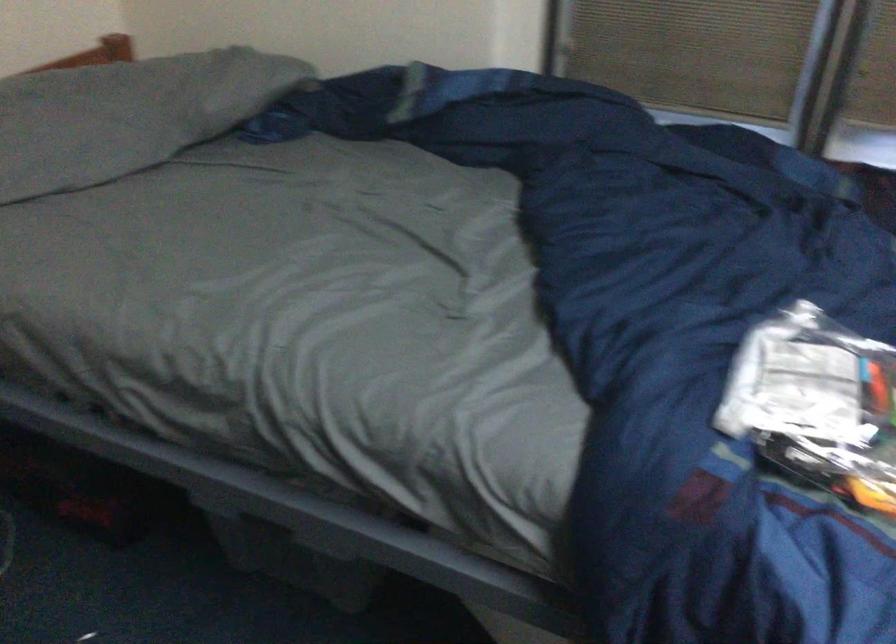
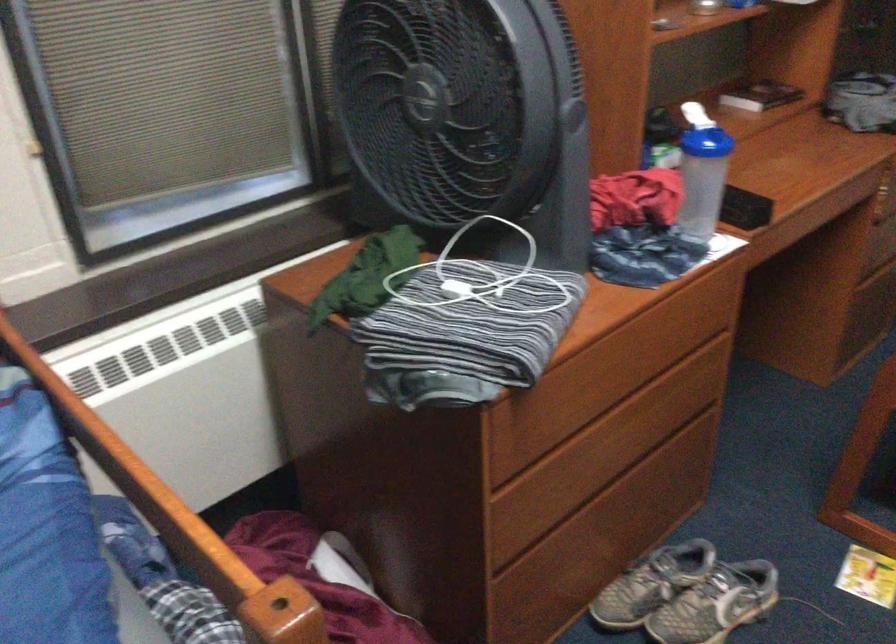
Question: The camera is either moving clockwise (left) or counter-clockwise (right) around the object. The first image is from the beginning of the video and the second image is from the end. Is the camera moving left or right when shooting the video?

Choices:
 (A) Left
 (B) Right

Answer: (A)